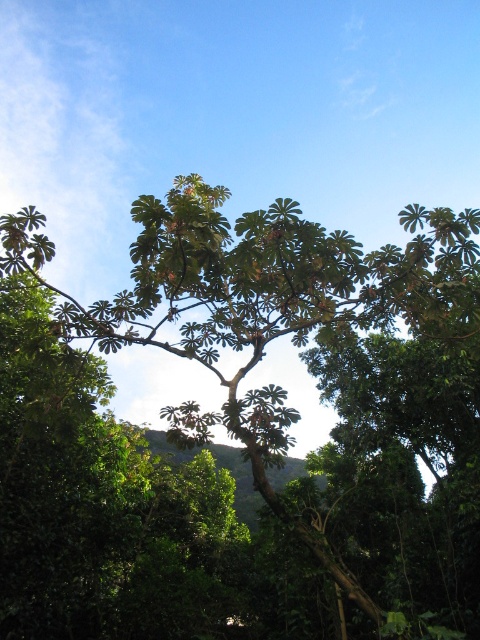
Which of these two, green leafy tree at center or green leafy hillside at center, stands taller?

With more height is green leafy tree at center.

Is green leafy tree at center below green leafy hillside at center?

Actually, green leafy tree at center is above green leafy hillside at center.

Which is behind, point (206, 301) or point (238, 467)?

Positioned behind is point (238, 467).

Identify the location of green leafy tree at center. The height and width of the screenshot is (640, 480). (243, 429).